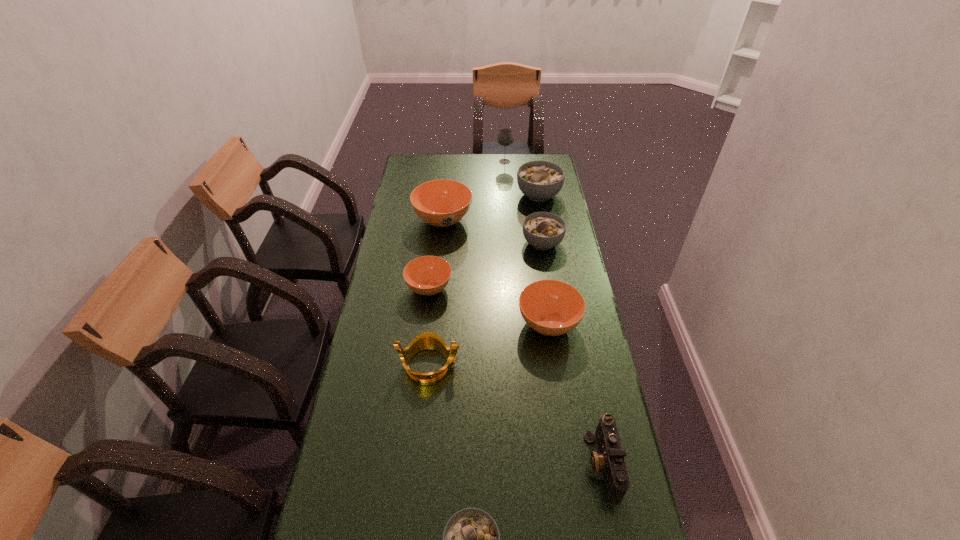
I want to click on tiara that is at the left edge, so click(x=427, y=340).

This screenshot has height=540, width=960. What are the coordinates of `camera at the right edge` in the screenshot? It's located at (x=610, y=460).

Where is `free spot at the far edge of the desktop`? The width and height of the screenshot is (960, 540). free spot at the far edge of the desktop is located at coordinates (503, 173).

The width and height of the screenshot is (960, 540). In the image, there is a desktop. Identify the location of free space at the left edge. tap(417, 242).

In the image, there is a desktop. At what (x,y) coordinates should I click in order to perform the action: click on vacant space at the right edge. Please return your answer as a coordinate pair (x, y). Image resolution: width=960 pixels, height=540 pixels. Looking at the image, I should click on (583, 295).

I want to click on vacant space at the far left corner of the desktop, so click(x=405, y=168).

Where is `vacant area between the rightmost peach soup bowl and the gold tiara`? This screenshot has height=540, width=960. vacant area between the rightmost peach soup bowl and the gold tiara is located at coordinates (489, 344).

You are a GUI agent. You are given a task and a screenshot of the screen. Output one action in this format:
    pyautogui.click(x=<x>, y=<y>)
    Task: Click on the free space between the tiara and the smallest peach soup bowl
    
    Given the screenshot: What is the action you would take?
    pyautogui.click(x=429, y=326)

Locate an element on the screen. This screenshot has height=540, width=960. free spot between the rightmost peach soup bowl and the camera is located at coordinates (576, 394).

Where is `free space between the farthest white soup bowl and the rightmost peach soup bowl`? The height and width of the screenshot is (540, 960). free space between the farthest white soup bowl and the rightmost peach soup bowl is located at coordinates (543, 259).